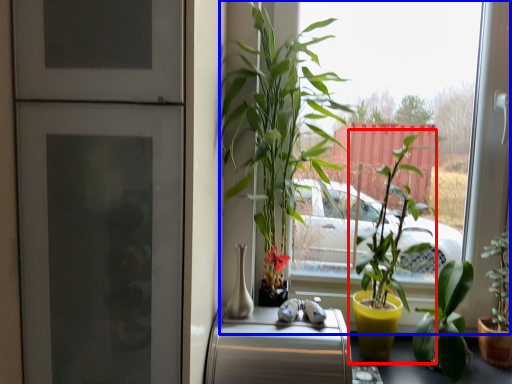
Question: Which object is further to the camera taking this photo, houseplant (highlighted by a red box) or window (highlighted by a blue box)?

Choices:
 (A) houseplant
 (B) window

Answer: (A)